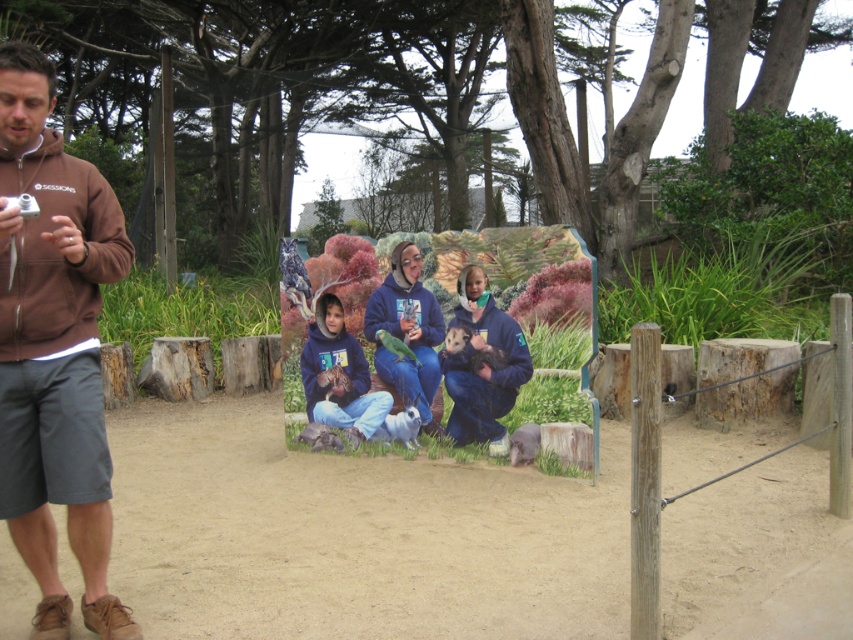
Does brown hoodie at left come in front of matte blue jacket at center?

Yes, it is in front of matte blue jacket at center.

Does point (39, 124) come in front of point (486, 416)?

Yes, point (39, 124) is closer to viewer.

Who is more forward, (38, 484) or (502, 394)?

Point (38, 484) is more forward.

Image resolution: width=853 pixels, height=640 pixels. I want to click on brown hoodie at left, so click(x=54, y=348).